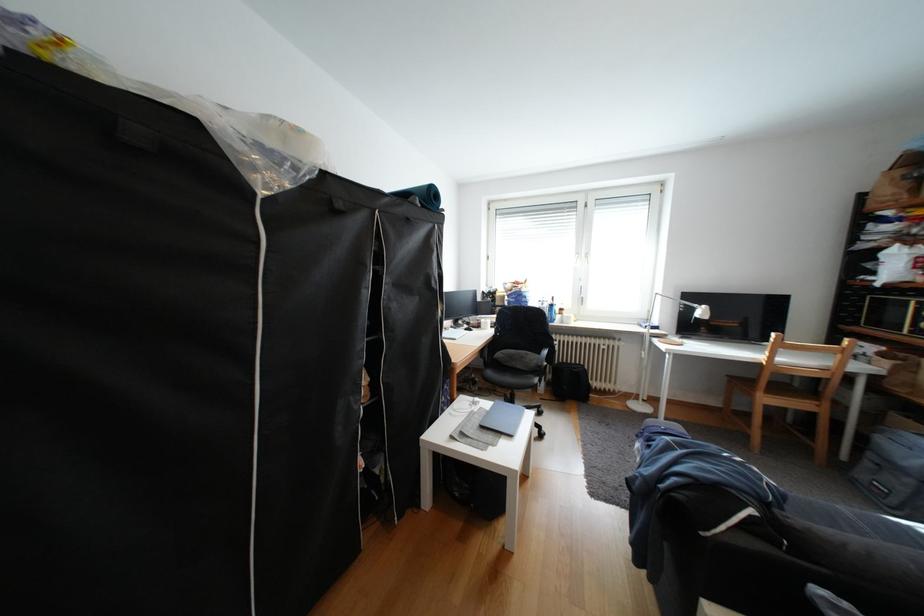
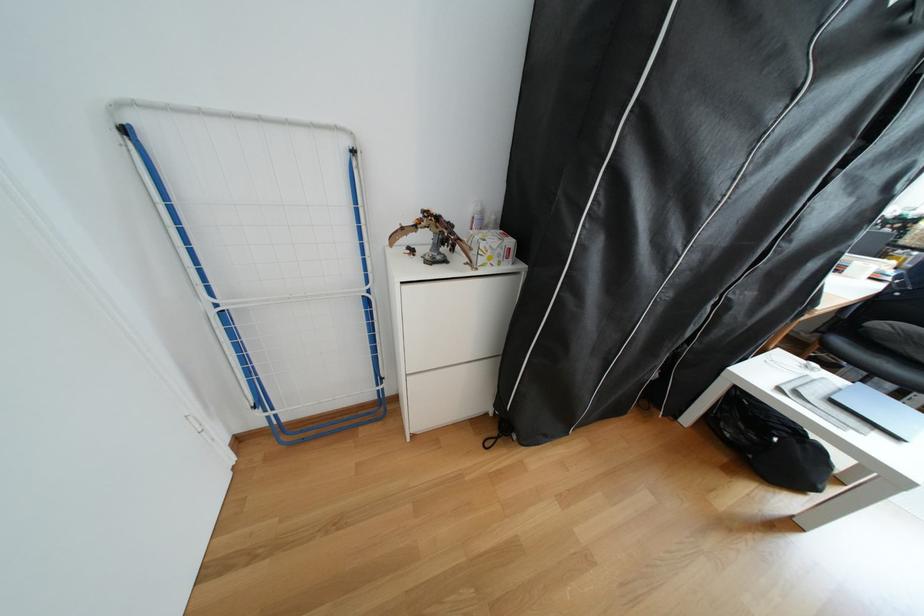
The point at (469,495) is marked in the first image. Where is the corresponding point in the second image?

(739, 436)